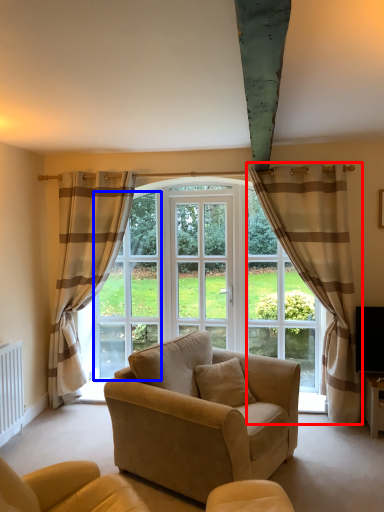
Question: Which of the following is the farthest to the observer, curtain (highlighted by a red box) or window screen (highlighted by a blue box)?

Choices:
 (A) curtain
 (B) window screen

Answer: (B)